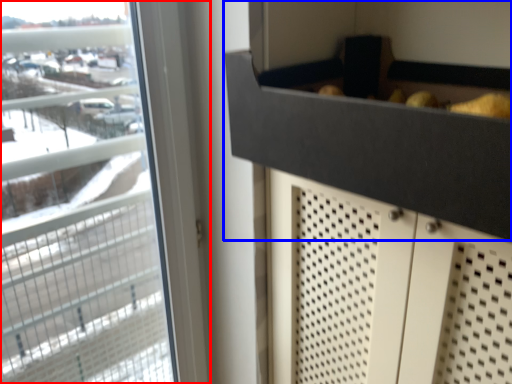
Question: Among these objects, which one is farthest to the camera, window (highlighted by a red box) or drawer (highlighted by a blue box)?

Choices:
 (A) window
 (B) drawer

Answer: (A)